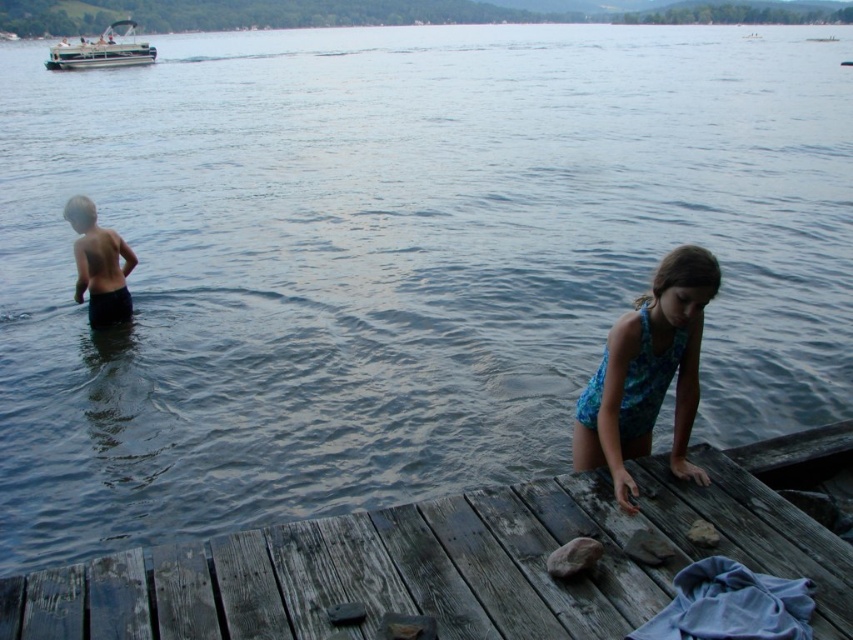
Question: Considering the relative positions of weathered wood dock at lower right and white plastic boat at upper left in the image provided, where is weathered wood dock at lower right located with respect to white plastic boat at upper left?

Choices:
 (A) left
 (B) right

Answer: (B)

Question: Which object appears closest to the camera in this image?

Choices:
 (A) white plastic boat at upper left
 (B) weathered wood dock at lower right
 (C) dark blue shorts at left
 (D) blue printed swimsuit at lower right

Answer: (B)

Question: Which object is the farthest from the weathered wood dock at lower right?

Choices:
 (A) white plastic boat at upper left
 (B) dark blue shorts at left
 (C) blue printed swimsuit at lower right

Answer: (A)

Question: Does blue printed swimsuit at lower right have a smaller size compared to dark blue shorts at left?

Choices:
 (A) yes
 (B) no

Answer: (B)

Question: Is weathered wood dock at lower right thinner than dark blue shorts at left?

Choices:
 (A) yes
 (B) no

Answer: (B)

Question: Among these points, which one is nearest to the camera?

Choices:
 (A) [653, 371]
 (B) [129, 296]
 (C) [142, 54]

Answer: (A)